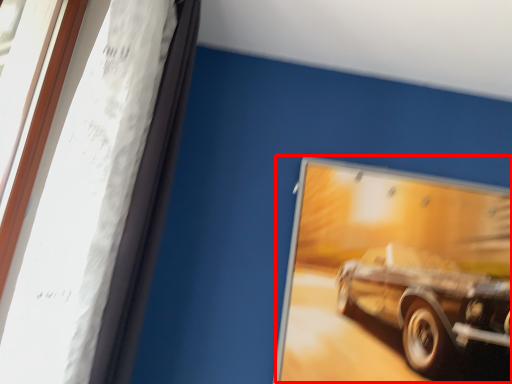
Question: From the image's perspective, where is car (annotated by the red box) located relative to window frame?

Choices:
 (A) below
 (B) above

Answer: (A)